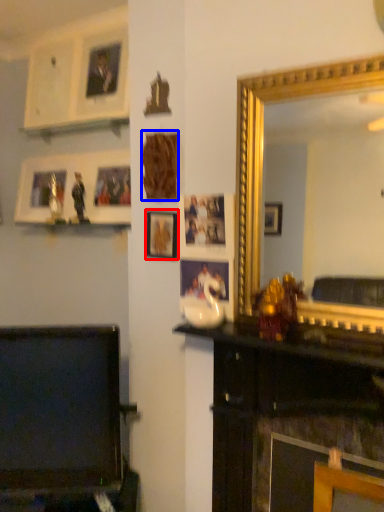
Question: Which object appears farthest to the camera in this image, picture frame (highlighted by a red box) or picture frame (highlighted by a blue box)?

Choices:
 (A) picture frame
 (B) picture frame

Answer: (A)